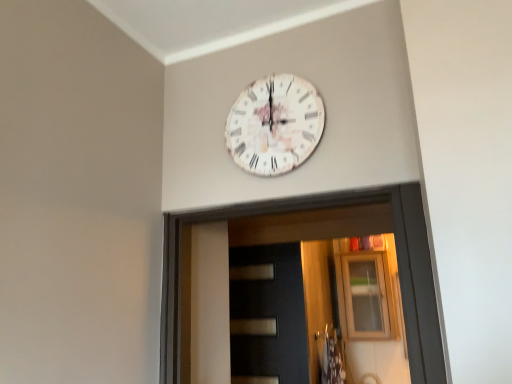
Question: Is dark matte door at center bigger or smaller than transparent glass cabinet at upper center?

Choices:
 (A) small
 (B) big

Answer: (A)

Question: From a real-world perspective, is dark matte door at center above or below transparent glass cabinet at upper center?

Choices:
 (A) above
 (B) below

Answer: (B)

Question: Which of these objects is positioned closest to the dark matte door at center?

Choices:
 (A) white paper-like clock at upper center
 (B) transparent glass cabinet at upper center

Answer: (B)

Question: Which object is positioned closest to the dark matte door at center?

Choices:
 (A) white paper-like clock at upper center
 (B) transparent glass cabinet at upper center

Answer: (B)